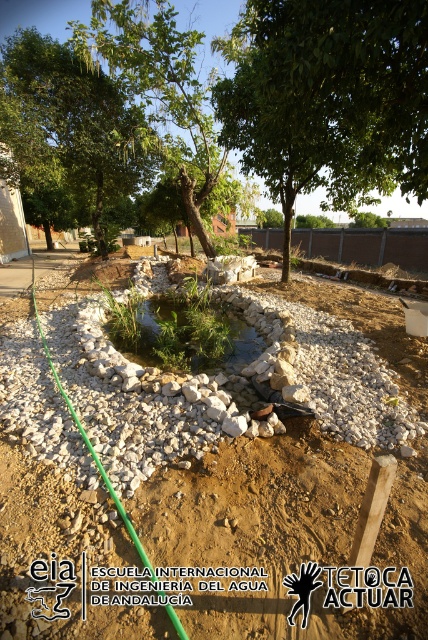
Can you confirm if green leafy tree at upper left is taller than green leafy tree at upper center?

Incorrect, green leafy tree at upper left's height is not larger of green leafy tree at upper center's.

Between green leafy tree at upper left and green leafy tree at upper center, which one is positioned higher?

green leafy tree at upper center is higher up.

Is point (26, 189) behind point (196, 225)?

Yes.

The image size is (428, 640). I want to click on green leafy tree at upper left, so click(68, 134).

Is white gravel pond at center wider than green leafy tree at upper left?

Incorrect, white gravel pond at center's width does not surpass green leafy tree at upper left's.

This screenshot has height=640, width=428. Describe the element at coordinates (244, 476) in the screenshot. I see `white gravel pond at center` at that location.

Where is `white gravel pond at center`? white gravel pond at center is located at coordinates (244, 476).

Between green leafy tree at center and green leafy tree at upper center, which one has more height?

Standing taller between the two is green leafy tree at upper center.

Does green leafy tree at center lie in front of green leafy tree at upper center?

Yes, green leafy tree at center is closer to the viewer.

Who is more distant from viewer, (x=362, y=134) or (x=178, y=180)?

Point (x=178, y=180)

Find the location of a particular element. The width and height of the screenshot is (428, 640). green leafy tree at center is located at coordinates (327, 99).